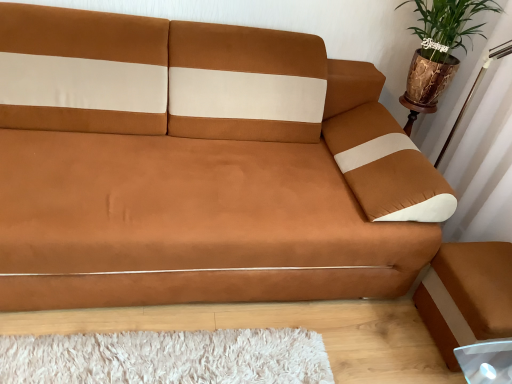
Where is `vacant space situated above brown leather footrest at lower right (from a real-world perspective)`? vacant space situated above brown leather footrest at lower right (from a real-world perspective) is located at coordinates (498, 281).